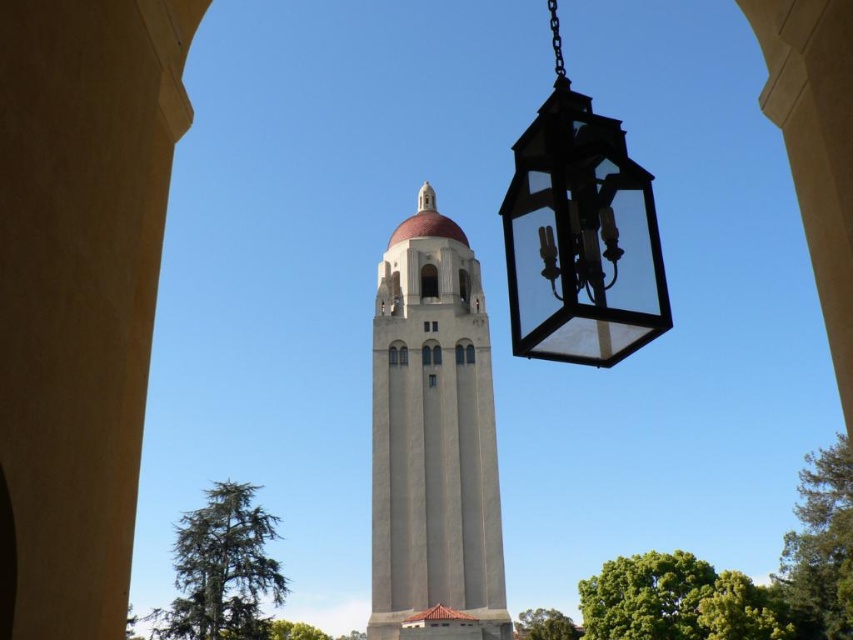
Question: Is smooth concrete tower at center thinner than black glass lantern at upper right?

Choices:
 (A) no
 (B) yes

Answer: (A)

Question: Among these objects, which one is farthest from the camera?

Choices:
 (A) smooth concrete tower at center
 (B) black glass lantern at upper right

Answer: (A)

Question: Where is smooth concrete tower at center located in relation to black glass lantern at upper right in the image?

Choices:
 (A) below
 (B) above

Answer: (A)

Question: Is smooth concrete tower at center positioned in front of black glass lantern at upper right?

Choices:
 (A) yes
 (B) no

Answer: (B)

Question: Which object is farther from the camera taking this photo?

Choices:
 (A) black glass lantern at upper right
 (B) smooth concrete tower at center

Answer: (B)